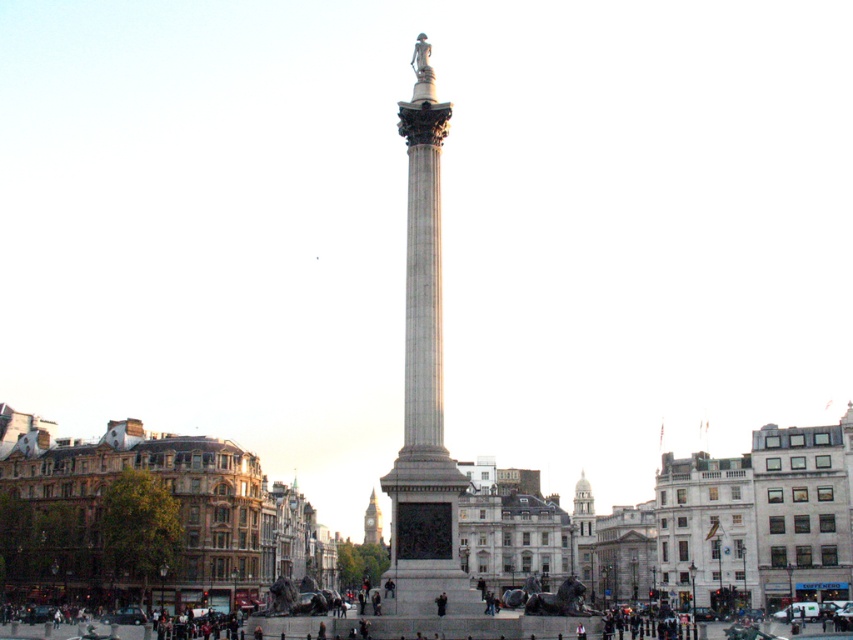
You are a tourist standing in the square and want to take a photo of both the smooth stone column at center and the golden stone clock tower at center. Which one should you focus on first to ensure both are in frame?

The smooth stone column at center is taller than the golden stone clock tower at center, so you should focus on the golden stone clock tower at center first to ensure both are in frame.

You are standing in the urban square and want to take a photo of the smooth stone column at center and the golden stone clock tower at center. Which one will appear closer to the camera in your photo?

The smooth stone column at center will appear closer to the camera in your photo because it is positioned in front of the golden stone clock tower at center.

You are standing in the urban square with Nelsons Column. You see two points marked as point 1 at coordinates (511, 561) and point 2 at (573, 509). Which point is closer to you from your current position?

Point 1 at coordinates (511, 561) is closer to you because it is in front of point 2 at (573, 509).